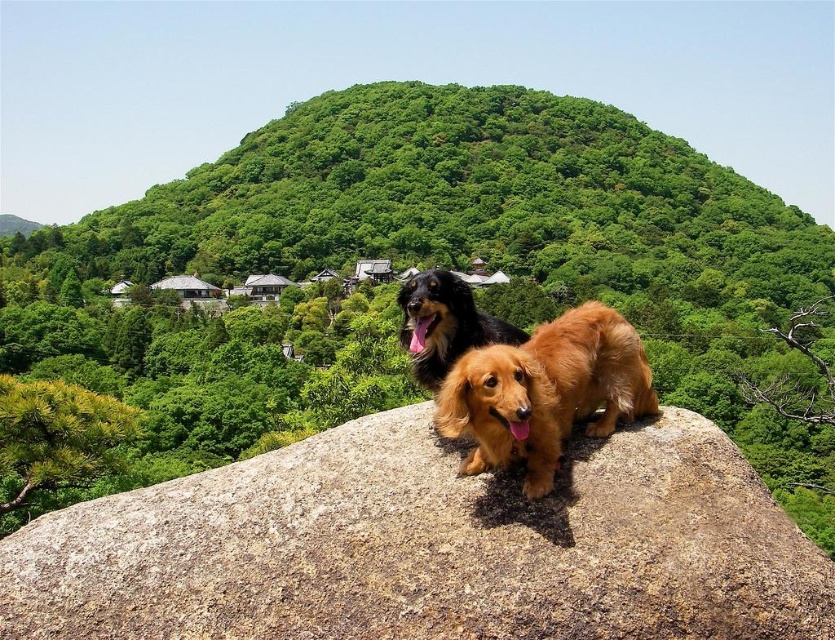
Question: Is brown textured rock at center wider than shiny black fur at center?

Choices:
 (A) no
 (B) yes

Answer: (B)

Question: Which point is farther to the camera?

Choices:
 (A) brown textured rock at center
 (B) green leafy hillside at center
 (C) golden brown fur at center

Answer: (B)

Question: Does green leafy hillside at center come in front of shiny black fur at center?

Choices:
 (A) no
 (B) yes

Answer: (A)

Question: Can you confirm if brown textured rock at center is bigger than golden brown fur at center?

Choices:
 (A) no
 (B) yes

Answer: (B)

Question: Based on their relative distances, which object is nearer to the green leafy hillside at center?

Choices:
 (A) brown textured rock at center
 (B) shiny black fur at center
 (C) golden brown fur at center

Answer: (A)

Question: Which point appears farthest from the camera in this image?

Choices:
 (A) (499, 336)
 (B) (559, 435)
 (C) (735, 406)
 (D) (811, 593)

Answer: (C)